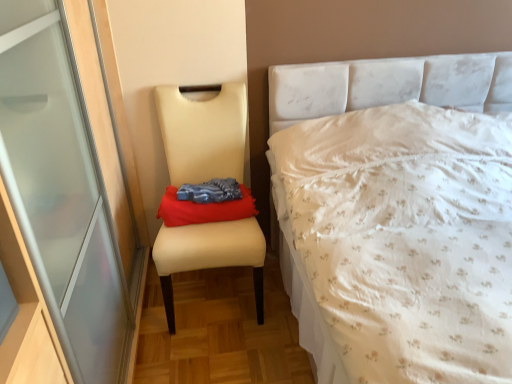
Question: Does beige leather chair at left have a larger size compared to white floral fabric bed at right?

Choices:
 (A) no
 (B) yes

Answer: (A)

Question: Is beige leather chair at left thinner than white floral fabric bed at right?

Choices:
 (A) yes
 (B) no

Answer: (A)

Question: Is beige leather chair at left turned away from white floral fabric bed at right?

Choices:
 (A) yes
 (B) no

Answer: (B)

Question: Can you confirm if beige leather chair at left is positioned to the right of white floral fabric bed at right?

Choices:
 (A) yes
 (B) no

Answer: (B)

Question: Is beige leather chair at left closer to the viewer compared to white floral fabric bed at right?

Choices:
 (A) yes
 (B) no

Answer: (B)

Question: Is beige leather chair at left outside of white floral fabric bed at right?

Choices:
 (A) no
 (B) yes

Answer: (B)

Question: Is white floral fabric bed at right positioned behind red fabric cloth at center?

Choices:
 (A) no
 (B) yes

Answer: (A)

Question: Is white floral fabric bed at right directly adjacent to red fabric cloth at center?

Choices:
 (A) no
 (B) yes

Answer: (A)

Question: From a real-world perspective, does white floral fabric bed at right sit lower than red fabric cloth at center?

Choices:
 (A) no
 (B) yes

Answer: (B)

Question: Considering the relative sizes of white floral fabric bed at right and red fabric cloth at center in the image provided, is white floral fabric bed at right smaller than red fabric cloth at center?

Choices:
 (A) no
 (B) yes

Answer: (A)

Question: Would you consider white floral fabric bed at right to be distant from red fabric cloth at center?

Choices:
 (A) yes
 (B) no

Answer: (B)

Question: Is white floral fabric bed at right bigger than red fabric cloth at center?

Choices:
 (A) yes
 (B) no

Answer: (A)

Question: Can you confirm if red fabric cloth at center is taller than beige leather chair at left?

Choices:
 (A) yes
 (B) no

Answer: (B)